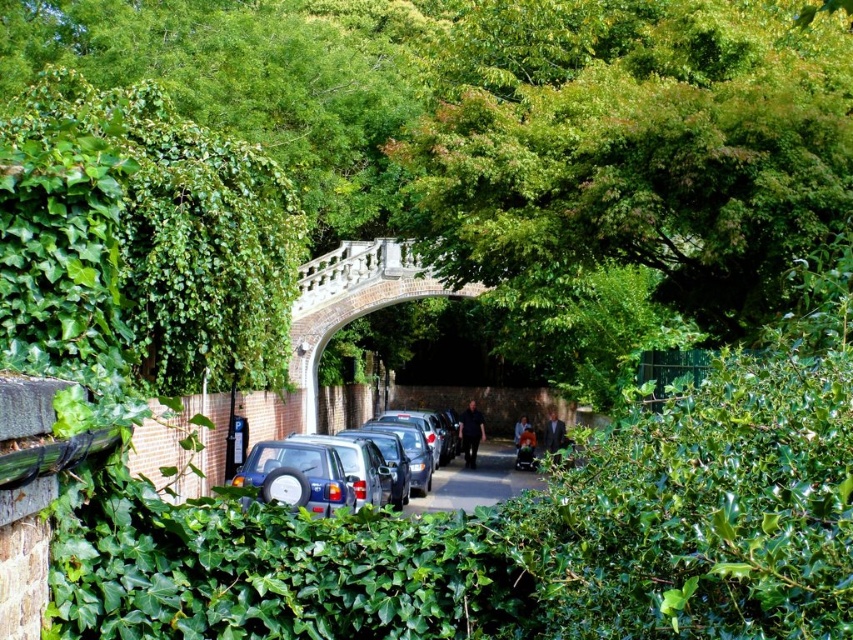
Question: Which point is farther to the camera?

Choices:
 (A) metallic gray car at center
 (B) satin silver car at center

Answer: (A)

Question: Which of the following is the farthest from the observer?

Choices:
 (A) coord(373,500)
 (B) coord(508,445)

Answer: (B)

Question: Can you confirm if satin silver car at center is bigger than metallic gray car at center?

Choices:
 (A) yes
 (B) no

Answer: (B)

Question: Is satin silver car at center bigger than metallic gray car at center?

Choices:
 (A) yes
 (B) no

Answer: (B)

Question: Which object is closer to the camera taking this photo?

Choices:
 (A) metallic gray car at center
 (B) satin silver car at center

Answer: (B)

Question: Is satin silver car at center wider than metallic gray car at center?

Choices:
 (A) yes
 (B) no

Answer: (B)